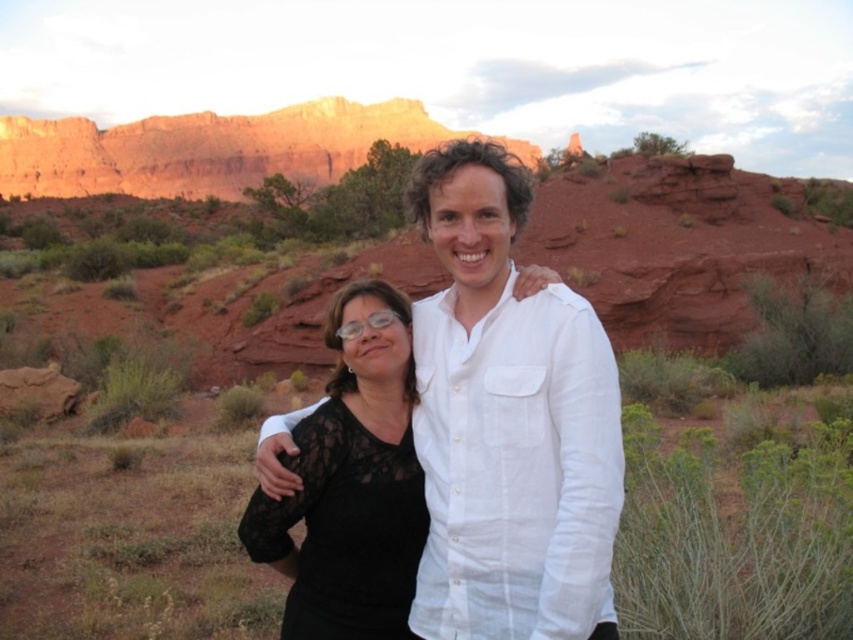
Is point (445, 253) farther from viewer compared to point (332, 502)?

That is True.

Between black lace dress at center and black lace top at center, which one appears on the right side from the viewer's perspective?

black lace dress at center

The image size is (853, 640). Describe the element at coordinates (508, 422) in the screenshot. I see `black lace dress at center` at that location.

The height and width of the screenshot is (640, 853). I want to click on black lace dress at center, so click(x=508, y=422).